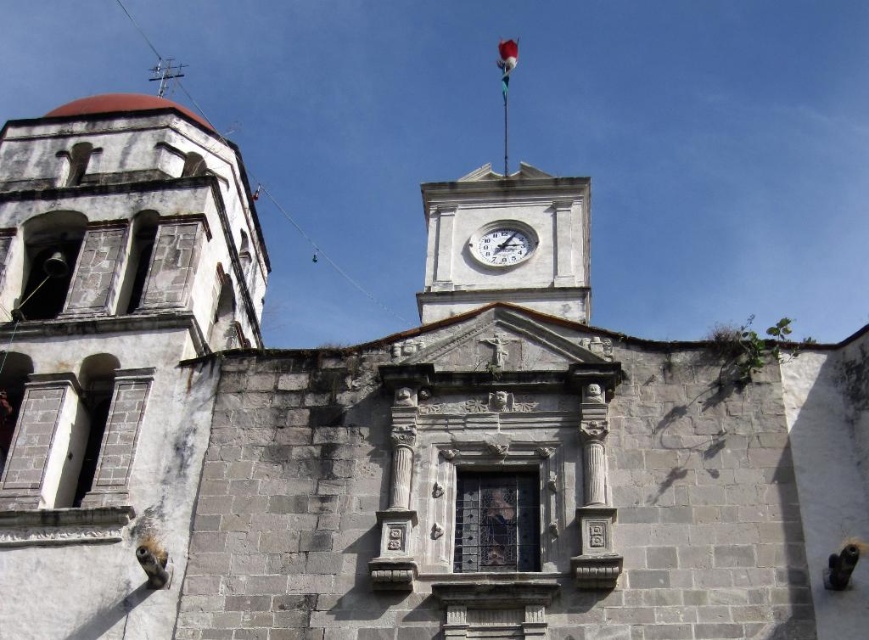
Does white stone clock tower at upper center have a lesser height compared to white glossy clock at upper center?

Incorrect, white stone clock tower at upper center's height does not fall short of white glossy clock at upper center's.

Does point (499, 253) lie in front of point (512, 227)?

Yes, it is.

Where is `white stone clock tower at upper center`? This screenshot has width=869, height=640. white stone clock tower at upper center is located at coordinates (506, 243).

I want to click on white stone clock tower at upper center, so pyautogui.click(x=506, y=243).